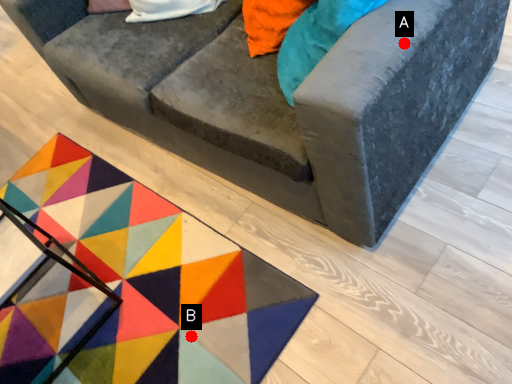
Question: Two points are circled on the image, labeled by A and B beside each circle. Which point is closer to the camera?

Choices:
 (A) A is closer
 (B) B is closer

Answer: (A)